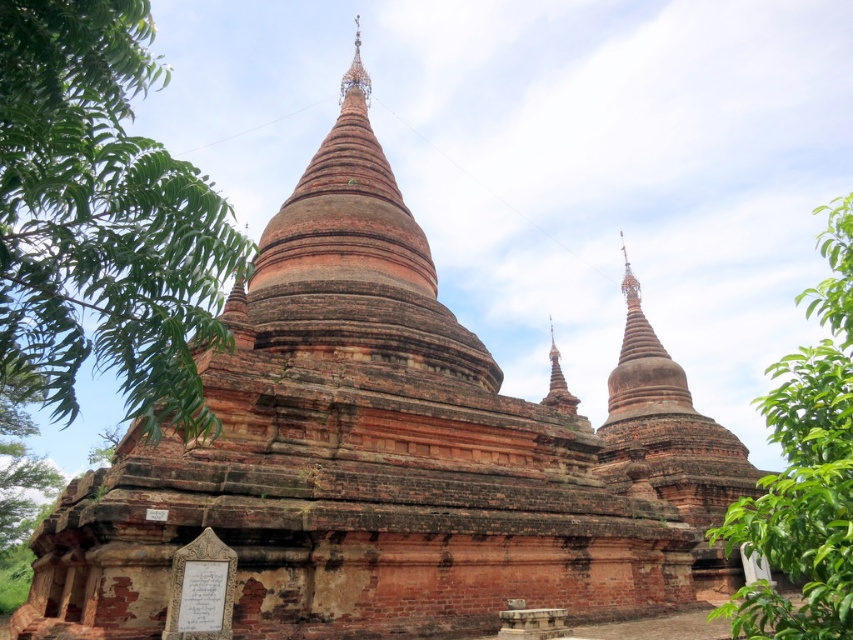
You are a drone operator tasked with capturing aerial footage of the historical site. Your drone has a maximum flight range of 70 meters. If you are currently positioned at the green leafy tree at left, can you fly your drone to the gold metallic spire at upper center without exceeding its range?

The green leafy tree at left and gold metallic spire at upper center are 71.97 meters apart from each other. Since the drone has a maximum flight range of 70 meters, it cannot reach the gold metallic spire at upper center from the green leafy tree at left without exceeding its range.

You are standing in a garden with two green leafy trees. You see a green leafy tree at left and a green leafy tree at right. Which tree is located to the left of the other?

The green leafy tree at left is positioned on the left side of green leafy tree at right.